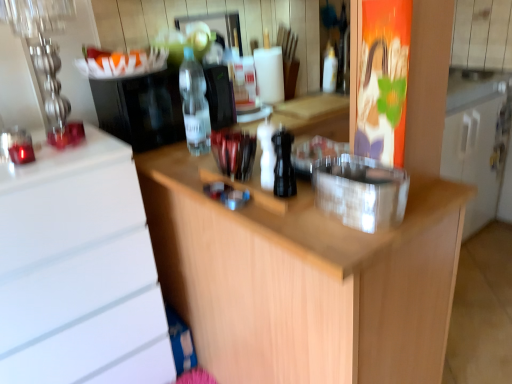
You are a GUI agent. You are given a task and a screenshot of the screen. Output one action in this format:
    pyautogui.click(x=<x>, y=<y>)
    Task: Click on the vacant space underneath transparent plastic container at center, which appears as the first appliance when viewed from the right (from a real-world perspective)
    
    Given the screenshot: What is the action you would take?
    pyautogui.click(x=349, y=208)